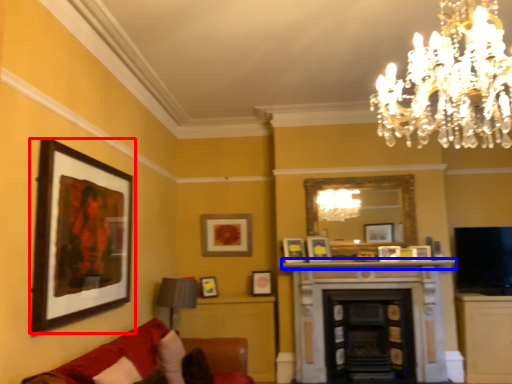
Question: Which point is further to the camera, picture frame (highlighted by a red box) or mantle (highlighted by a blue box)?

Choices:
 (A) picture frame
 (B) mantle

Answer: (B)